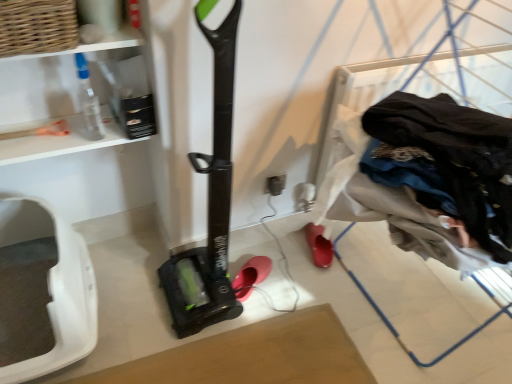
Question: Looking at the image, does woven brown basket at upper left seem bigger or smaller compared to translucent plastic bottle at upper left?

Choices:
 (A) big
 (B) small

Answer: (B)

Question: Considering the positions of point (46, 1) and point (73, 56), is point (46, 1) closer or farther from the camera than point (73, 56)?

Choices:
 (A) farther
 (B) closer

Answer: (B)

Question: Which object is the farthest from the dark blue fabric at right?

Choices:
 (A) matte gray electric outlet at center
 (B) pink matte shoe at center, the first footwear when ordered from left to right
 (C) white plastic pet carrier at lower left
 (D) woven brown basket at upper left
 (E) translucent plastic bottle at upper left

Answer: (C)

Question: Estimate the real-world distances between objects in this image. Which object is farther from the dark blue fabric at right?

Choices:
 (A) pink matte shoe at center, placed as the 2th footwear when sorted from right to left
 (B) matte gray electric outlet at center
 (C) rubberized red shoe at lower center, marked as the second footwear in a left-to-right arrangement
 (D) white plastic pet carrier at lower left
 (E) translucent plastic bottle at upper left

Answer: (D)